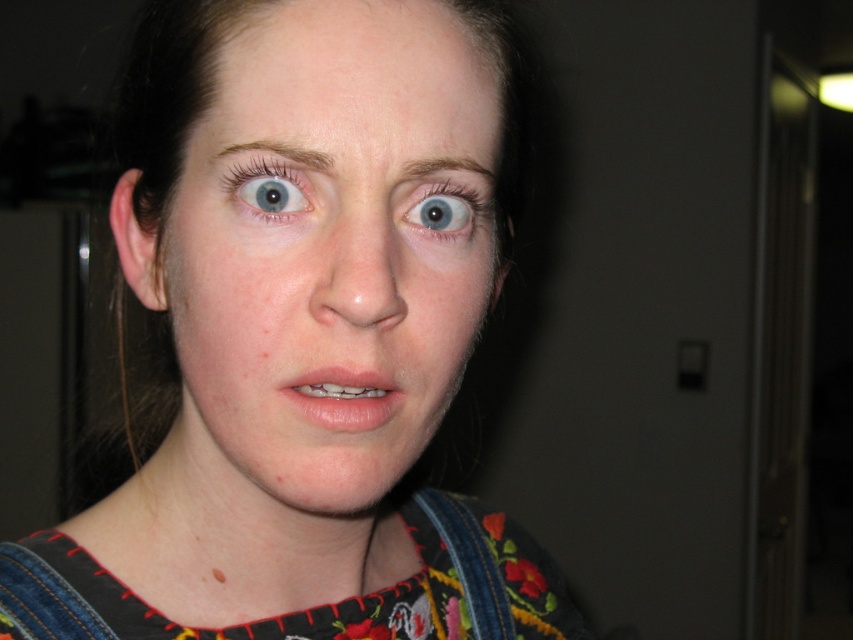
Question: Among these points, which one is nearest to the camera?

Choices:
 (A) (257, 148)
 (B) (341, 189)
 (C) (445, 188)
 (D) (329, 424)

Answer: (D)

Question: Which object appears closest to the camera in this image?

Choices:
 (A) smooth skin face at center
 (B) brown matte eyebrow at upper center
 (C) blue glossy eye at upper center
 (D) blue glossy eye at center

Answer: (A)

Question: Among these points, which one is farthest from the camera?

Choices:
 (A) (215, 576)
 (B) (473, 163)

Answer: (A)

Question: Does blue glossy eye at upper center appear under brown matte freckle at lower center?

Choices:
 (A) no
 (B) yes

Answer: (A)

Question: Is smooth skin face at center to the left of brown matte eyebrow at upper center from the viewer's perspective?

Choices:
 (A) no
 (B) yes

Answer: (B)

Question: Is blue glossy eye at center above brown matte eyebrow at upper center?

Choices:
 (A) yes
 (B) no

Answer: (B)